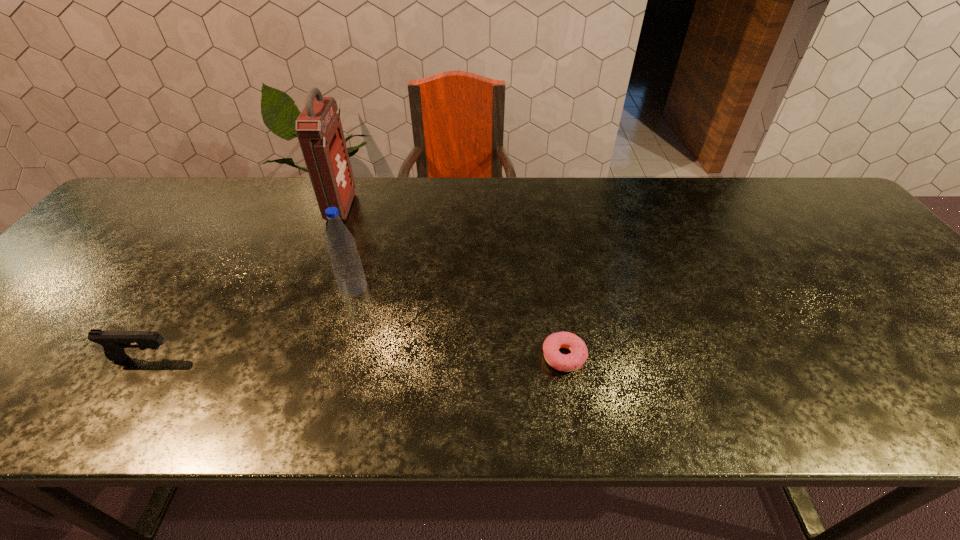
You are a GUI agent. You are given a task and a screenshot of the screen. Output one action in this format:
    pyautogui.click(x=<x>, y=<y>)
    Task: Click on the farthest object
    The width and height of the screenshot is (960, 540).
    Given the screenshot: What is the action you would take?
    pyautogui.click(x=319, y=130)

At what (x,y) coordinates should I click in order to perform the action: click on the second object from left to right. Please return your answer as a coordinate pair (x, y). The image size is (960, 540). Looking at the image, I should click on (319, 130).

Find the location of a particular element. This screenshot has width=960, height=540. water bottle is located at coordinates (346, 264).

The height and width of the screenshot is (540, 960). What are the coordinates of `the third shortest object` in the screenshot? It's located at (346, 264).

The height and width of the screenshot is (540, 960). What are the coordinates of `pistol` in the screenshot? It's located at (113, 342).

Image resolution: width=960 pixels, height=540 pixels. Identify the location of the second shortest object. (113, 342).

I want to click on doughnut, so click(570, 362).

Find the location of a particular element. This screenshot has width=960, height=540. the shortest object is located at coordinates (570, 362).

Identify the location of free space located on the front-facing side of the second object from left to right. This screenshot has width=960, height=540. (389, 207).

You are a GUI agent. You are given a task and a screenshot of the screen. Output one action in this format:
    pyautogui.click(x=<x>, y=<y>)
    Task: Click on the vacant space located 0.060m on the left of the third nearest object
    This screenshot has height=540, width=960.
    Given the screenshot: What is the action you would take?
    pyautogui.click(x=315, y=287)